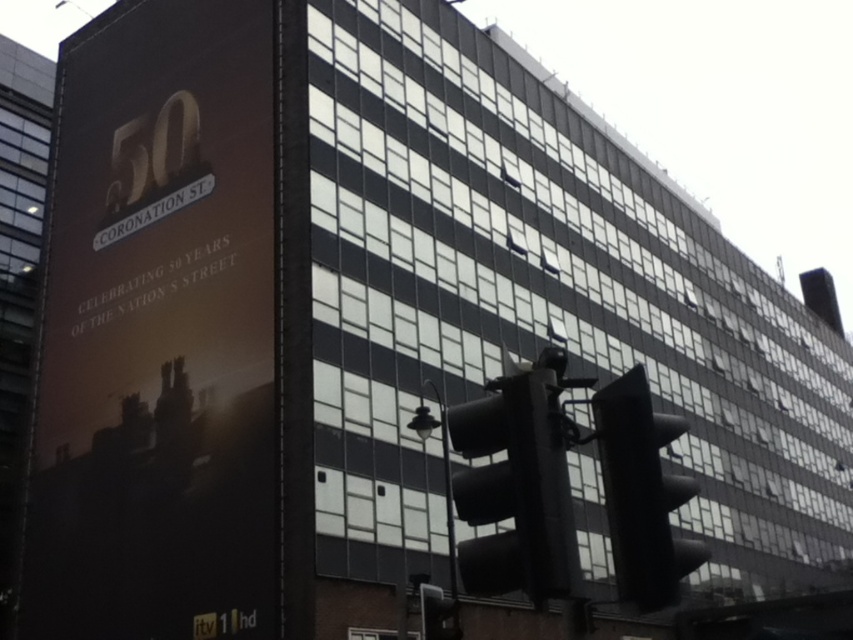
Question: Does black matte traffic light at lower center appear on the right side of black matte traffic light at lower right?

Choices:
 (A) yes
 (B) no

Answer: (B)

Question: Estimate the real-world distances between objects in this image. Which object is farther from the black plastic traffic light at lower center?

Choices:
 (A) black matte traffic light at lower center
 (B) black matte traffic light at lower right
 (C) black plastic pole at lower center

Answer: (B)

Question: Which point is closer to the camera?

Choices:
 (A) (567, 496)
 (B) (670, 435)
 (C) (421, 598)
 (D) (450, 572)

Answer: (A)

Question: Does black matte traffic light at lower right have a greater width compared to black plastic pole at lower center?

Choices:
 (A) no
 (B) yes

Answer: (B)

Question: Which of the following is the closest to the observer?

Choices:
 (A) (444, 444)
 (B) (454, 604)

Answer: (B)

Question: Can you confirm if black matte traffic light at lower right is bigger than black plastic pole at lower center?

Choices:
 (A) no
 (B) yes

Answer: (B)